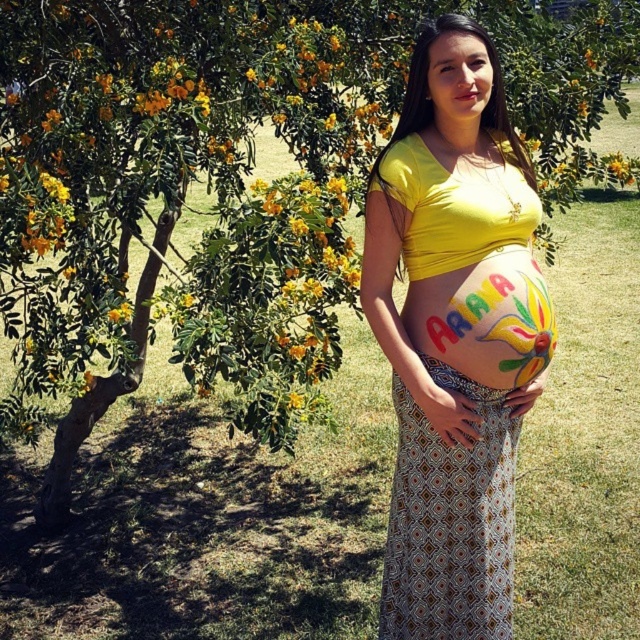
Question: Does matte yellow shirt at center come behind patterned fabric dress at center?

Choices:
 (A) no
 (B) yes

Answer: (A)

Question: Which point is farther from the camera taking this photo?

Choices:
 (A) (403, 589)
 (B) (476, 220)

Answer: (A)

Question: Can you confirm if matte yellow shirt at center is positioned to the left of patterned fabric dress at center?

Choices:
 (A) no
 (B) yes

Answer: (A)

Question: Which point is closer to the camera?

Choices:
 (A) (468, 513)
 (B) (422, 83)

Answer: (A)

Question: Among these objects, which one is farthest from the camera?

Choices:
 (A) matte yellow shirt at center
 (B) patterned fabric dress at center
 (C) painted colorful belly at center

Answer: (B)

Question: Can you confirm if matte yellow shirt at center is positioned to the left of patterned fabric dress at center?

Choices:
 (A) no
 (B) yes

Answer: (A)